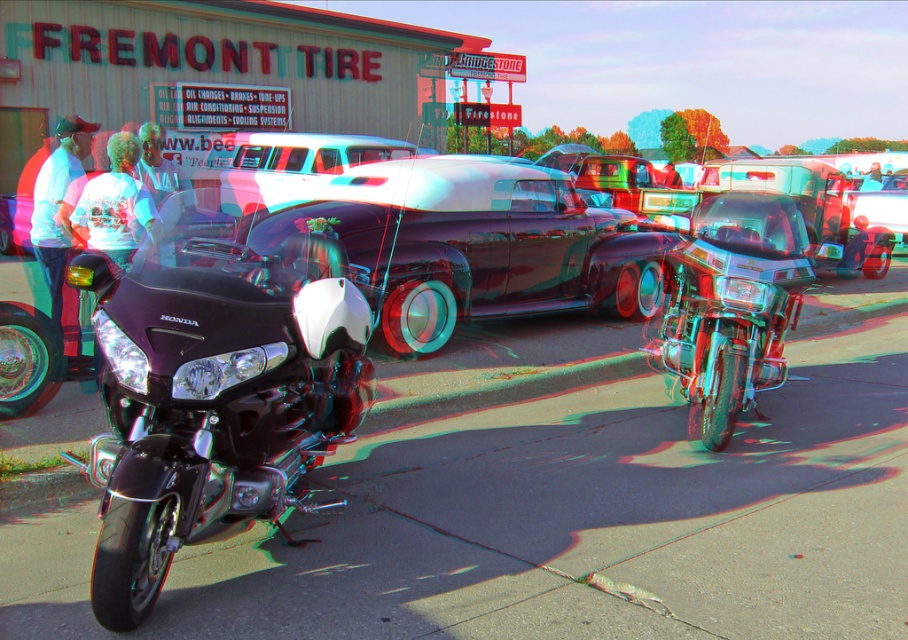
You are a photographer at the car show and need to capture a clear photo of the shiny chrome car at center without the white glossy limousine at center blocking it. What should you do?

Move to a position where the white glossy limousine at center is no longer in front of the shiny chrome car at center, allowing you to capture the shiny chrome car at center clearly.

You are a photographer standing at the edge of the car show. You want to take a photo of both the glossy black car at center and the white cotton shirt at center in the same frame. Given that your camera has a maximum focus range of 5 meters, will you be able to capture both objects clearly in one shot?

The glossy black car at center and white cotton shirt at center are 5.26 meters apart. Since the distance between them exceeds the camera maximum focus range of 5 meters, you cannot capture both objects clearly in one shot.